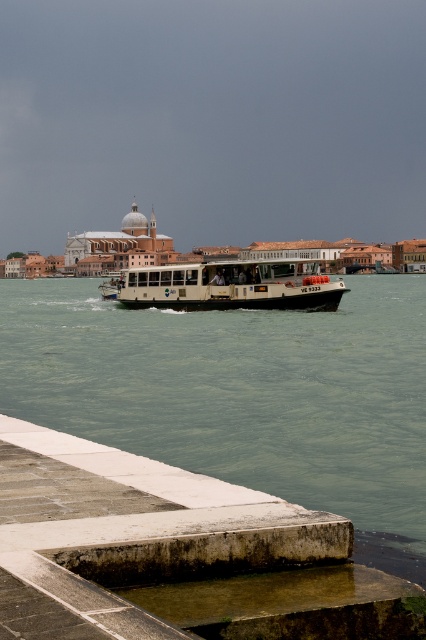
From the picture: Who is shorter, clear water at center or concrete dock at lower left?

Standing shorter between the two is concrete dock at lower left.

Who is positioned more to the left, clear water at center or concrete dock at lower left?

From the viewer's perspective, clear water at center appears more on the left side.

The width and height of the screenshot is (426, 640). In order to click on clear water at center in this screenshot , I will do `click(242, 396)`.

Is concrete dock at lower left thinner than white matte boat at center?

Yes, concrete dock at lower left is thinner than white matte boat at center.

Does point (187, 518) come in front of point (328, 285)?

Yes, point (187, 518) is closer to viewer.

At what (x,y) coordinates should I click in order to perform the action: click on concrete dock at lower left. Please return your answer as a coordinate pair (x, y). Looking at the image, I should click on (143, 540).

Is clear water at center smaller than white matte boat at center?

No, clear water at center is not smaller than white matte boat at center.

Measure the distance between clear water at center and camera.

clear water at center and camera are 12.37 meters apart from each other.

Locate an element on the screen. This screenshot has height=640, width=426. clear water at center is located at coordinates (242, 396).